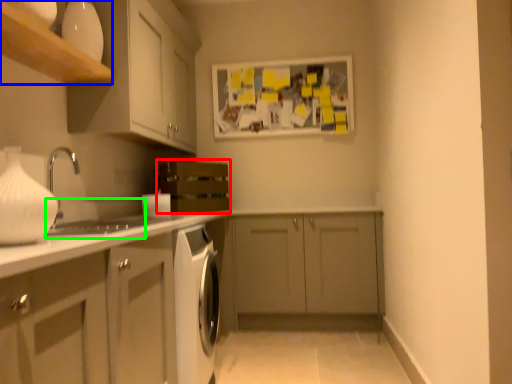
Question: Which object is positioned farthest from oven (highlighted by a red box)? Select from shelf (highlighted by a blue box) and sink (highlighted by a green box).

Choices:
 (A) shelf
 (B) sink

Answer: (A)